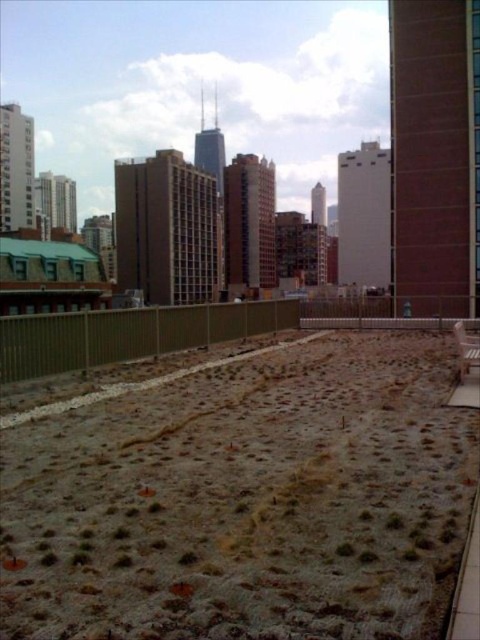
Question: Is wooden park bench at center behind green fuzzy plant at center?

Choices:
 (A) yes
 (B) no

Answer: (A)

Question: Is wooden park bench at center below green fuzzy plant at center?

Choices:
 (A) no
 (B) yes

Answer: (A)

Question: Is wooden park bench at center above green fuzzy plant at center?

Choices:
 (A) no
 (B) yes

Answer: (B)

Question: Among these objects, which one is farthest from the camera?

Choices:
 (A) green fuzzy plant at center
 (B) wooden park bench at center

Answer: (B)